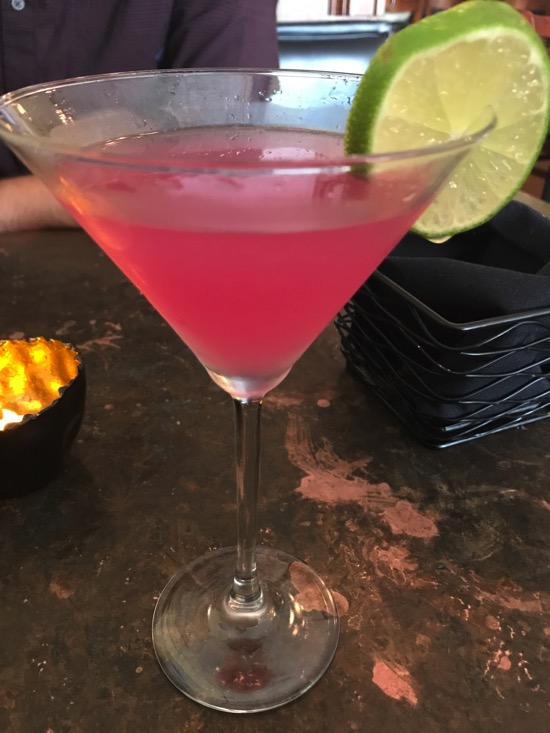
You are a GUI agent. You are given a task and a screenshot of the screen. Output one action in this format:
    pyautogui.click(x=<x>, y=<y>)
    Task: Click on the window
    The image size is (550, 733).
    Given the screenshot: What is the action you would take?
    pyautogui.click(x=298, y=10), pyautogui.click(x=358, y=7), pyautogui.click(x=384, y=6)